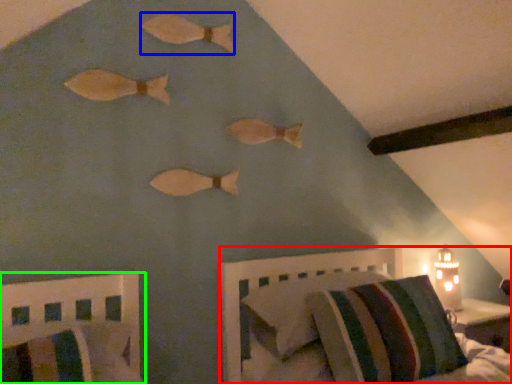
Question: Based on their relative distances, which object is nearer to furniture (highlighted by a red box)? Choose from animal (highlighted by a blue box) and furniture (highlighted by a green box).

Choices:
 (A) animal
 (B) furniture

Answer: (B)